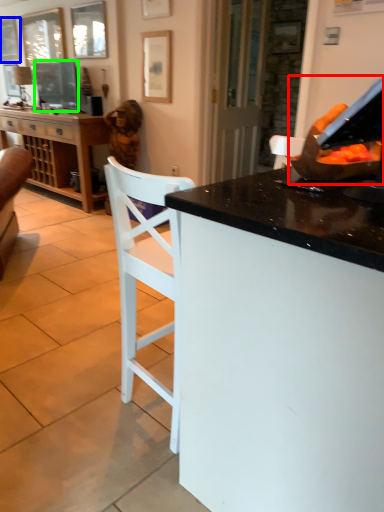
Question: Estimate the real-world distances between objects in this image. Which object is closer to appliance (highlighted by a red box), picture frame (highlighted by a blue box) or television (highlighted by a green box)?

Choices:
 (A) picture frame
 (B) television

Answer: (B)